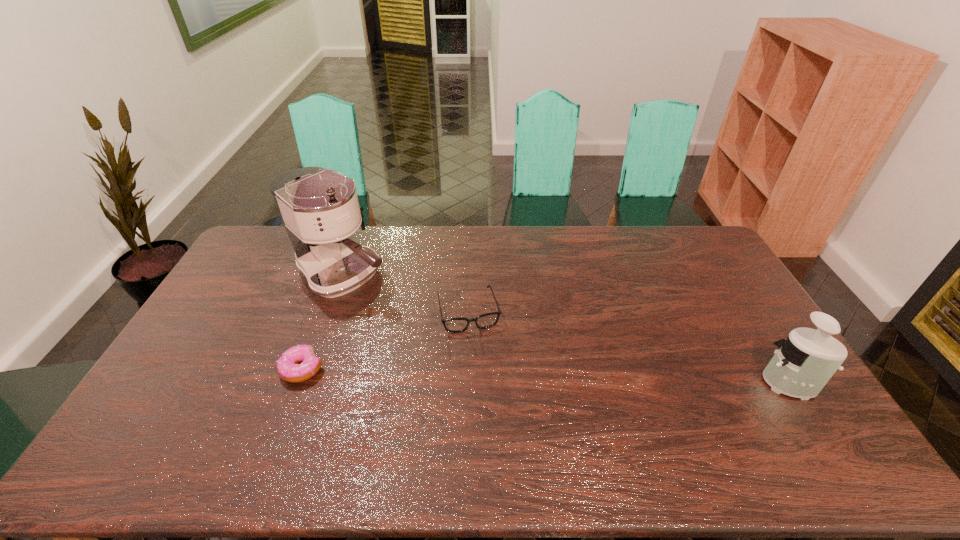
Where is `vacant spot on the desktop that is between the doughnut and the juicer and is positioned on the front-facing side of the coffee maker`? The width and height of the screenshot is (960, 540). vacant spot on the desktop that is between the doughnut and the juicer and is positioned on the front-facing side of the coffee maker is located at coordinates (487, 374).

Where is `vacant space on the desktop that is between the doughnut and the rightmost object and is positioned on the front-facing side of the spectacles`? vacant space on the desktop that is between the doughnut and the rightmost object and is positioned on the front-facing side of the spectacles is located at coordinates (484, 374).